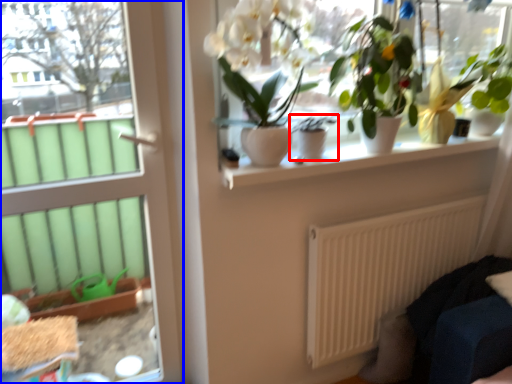
Question: Which of the following is the closest to the observer, houseplant (highlighted by a red box) or door (highlighted by a blue box)?

Choices:
 (A) houseplant
 (B) door

Answer: (B)